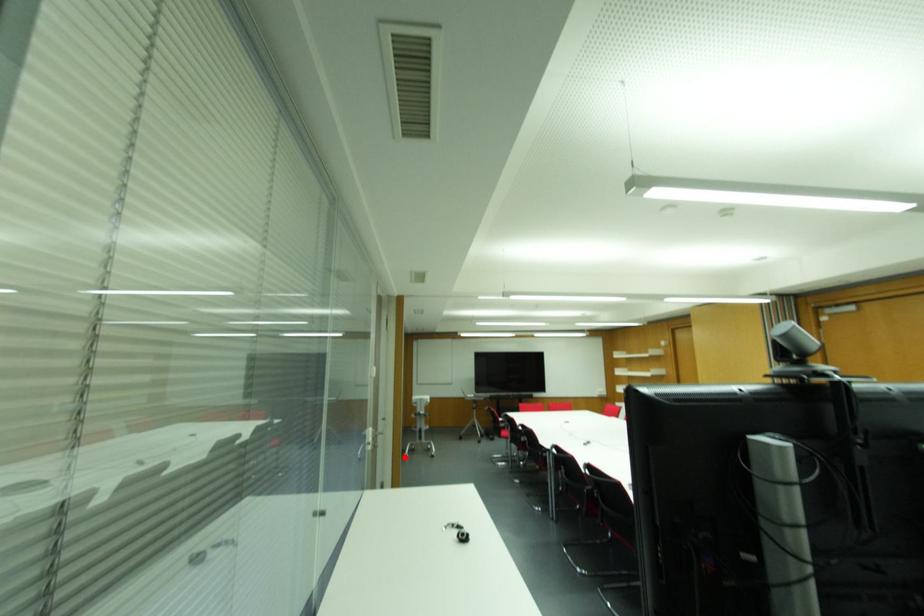
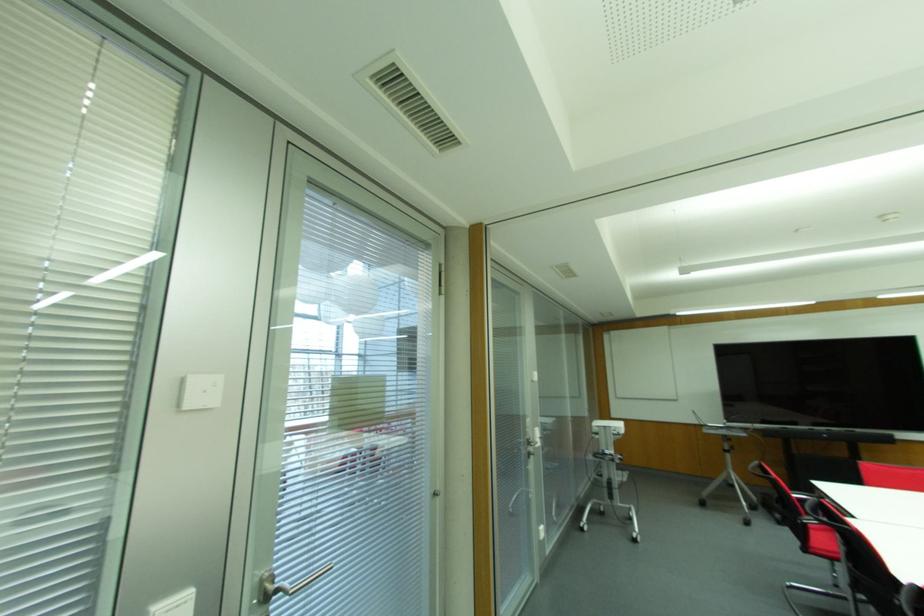
Find the pixel in the second image that matches the highlighted location in the first image.

(581, 529)